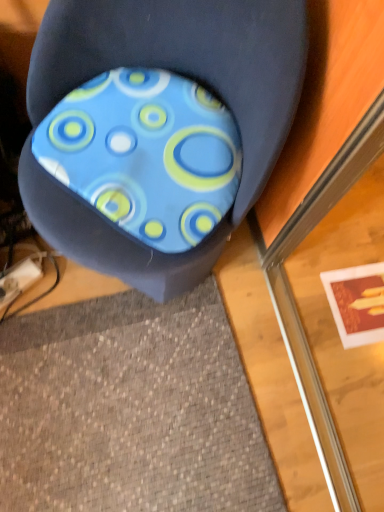
Describe the element at coordinates (157, 129) in the screenshot. I see `blue fabric cushion at center` at that location.

I want to click on blue fabric cushion at center, so click(157, 129).

Describe the element at coordinates (145, 154) in the screenshot. The height and width of the screenshot is (512, 384). I see `blue fabric cushion at center` at that location.

The image size is (384, 512). Identify the location of blue fabric cushion at center. (145, 154).

Find the location of a particular element. blue fabric cushion at center is located at coordinates (157, 129).

Between blue fabric cushion at center and blue fabric cushion at center, which one appears on the right side from the viewer's perspective?

blue fabric cushion at center is more to the right.

In the scene shown: Which object is closer to the camera, blue fabric cushion at center or blue fabric cushion at center?

blue fabric cushion at center is more forward.

Considering the points (143, 128) and (162, 161), which point is behind, point (143, 128) or point (162, 161)?

The point (143, 128) is more distant.

From the image's perspective, which one is positioned lower, blue fabric cushion at center or blue fabric cushion at center?

blue fabric cushion at center.

From a real-world perspective, does blue fabric cushion at center sit lower than blue fabric cushion at center?

Yes, from a real-world perspective, blue fabric cushion at center is under blue fabric cushion at center.

Is blue fabric cushion at center wider or thinner than blue fabric cushion at center?

Clearly, blue fabric cushion at center has more width compared to blue fabric cushion at center.

From their relative heights in the image, would you say blue fabric cushion at center is taller or shorter than blue fabric cushion at center?

Considering their sizes, blue fabric cushion at center has more height than blue fabric cushion at center.

Is blue fabric cushion at center smaller than blue fabric cushion at center?

No, blue fabric cushion at center is not smaller than blue fabric cushion at center.

Would you say blue fabric cushion at center is outside blue fabric cushion at center?

Indeed, blue fabric cushion at center is completely outside blue fabric cushion at center.

Is blue fabric cushion at center not close to blue fabric cushion at center?

That's not correct — blue fabric cushion at center is a little close to blue fabric cushion at center.

Consider the image. Could you tell me if blue fabric cushion at center is facing blue fabric cushion at center?

Yes, blue fabric cushion at center is facing blue fabric cushion at center.

What's the angular difference between blue fabric cushion at center and blue fabric cushion at center's facing directions?

The angular difference between blue fabric cushion at center and blue fabric cushion at center is 6.68 degrees.

The height and width of the screenshot is (512, 384). Find the location of `chair lying in front of the blue fabric cushion at center`. chair lying in front of the blue fabric cushion at center is located at coordinates (157, 129).

Does blue fabric cushion at center appear on the left side of blue fabric cushion at center?

Incorrect, blue fabric cushion at center is not on the left side of blue fabric cushion at center.

Which object is closer to the camera taking this photo, blue fabric cushion at center or blue fabric cushion at center?

blue fabric cushion at center is closer to the camera.

Is point (215, 112) positioned in front of point (192, 72)?

Yes, point (215, 112) is closer to viewer.

Looking at this image, from the image's perspective, is blue fabric cushion at center positioned above or below blue fabric cushion at center?

blue fabric cushion at center is situated higher than blue fabric cushion at center in the image.

From a real-world perspective, who is located higher, blue fabric cushion at center or blue fabric cushion at center?

From a 3D spatial view, blue fabric cushion at center is above.

Considering the relative sizes of blue fabric cushion at center and blue fabric cushion at center in the image provided, is blue fabric cushion at center wider than blue fabric cushion at center?

In fact, blue fabric cushion at center might be narrower than blue fabric cushion at center.

Between blue fabric cushion at center and blue fabric cushion at center, which one has less height?

With less height is blue fabric cushion at center.

Which of these two, blue fabric cushion at center or blue fabric cushion at center, is bigger?

blue fabric cushion at center is bigger.

Is blue fabric cushion at center positioned beyond the bounds of blue fabric cushion at center?

No, blue fabric cushion at center is not outside of blue fabric cushion at center.

Is blue fabric cushion at center far from blue fabric cushion at center?

No.

Is blue fabric cushion at center at the back of blue fabric cushion at center?

Yes.

Can you tell me how much blue fabric cushion at center and blue fabric cushion at center differ in facing direction?

They differ by 6.68 degrees in their facing directions.

How far apart are blue fabric cushion at center and blue fabric cushion at center?

The distance of blue fabric cushion at center from blue fabric cushion at center is 1.40 inches.

The image size is (384, 512). What are the coordinates of `chair below the blue fabric cushion at center (from the image's perspective)` in the screenshot? It's located at (157, 129).

Locate an element on the screen. Image resolution: width=384 pixels, height=512 pixels. chair located in front of the blue fabric cushion at center is located at coordinates click(157, 129).

Find the location of a particular element. The image size is (384, 512). chair below the blue fabric cushion at center (from a real-world perspective) is located at coordinates (157, 129).